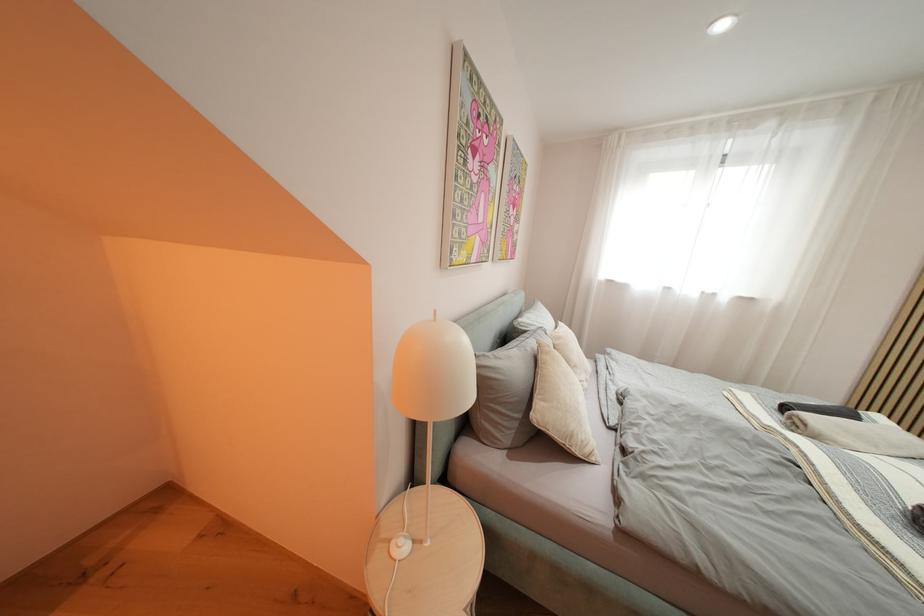
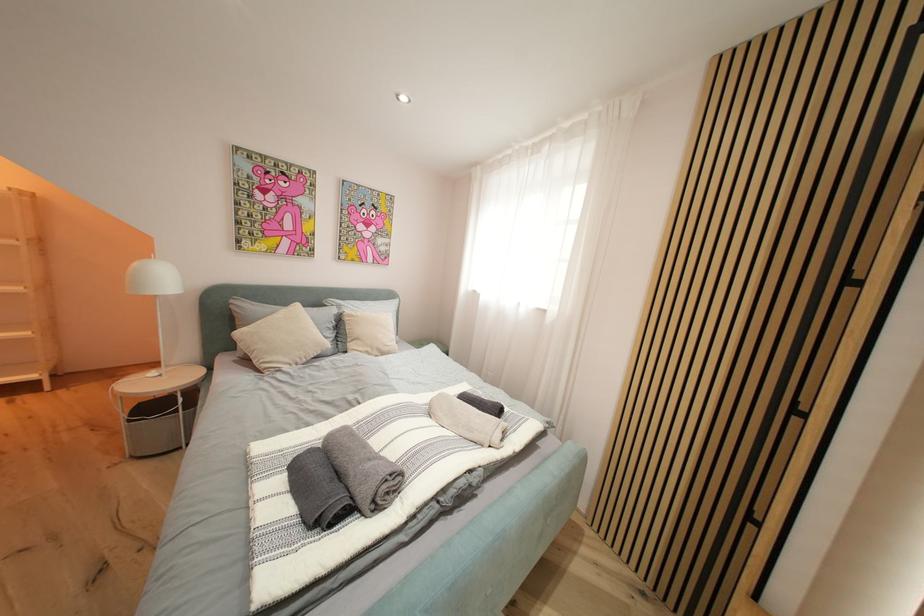
Question: Which direction would the cameraman need to move to produce the second image? Reply with the corresponding letter.

Choices:
 (A) Left
 (B) Right
 (C) Forward
 (D) Backward

Answer: (B)